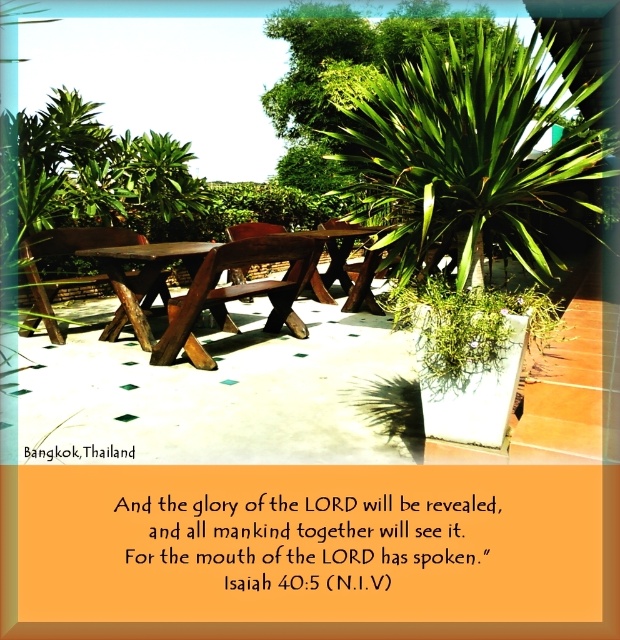
You are planning to host a small gathering in the outdoor seating area in Bangkok. You need to seat 8 people. Which table between the dark brown wood picnic table at center and the brown wooden table at center can accommodate more guests?

The dark brown wood picnic table at center can accommodate more guests because its width is larger than the brown wooden table at center.

You are planning to host a small gathering for 10 people in the outdoor seating area. Which table between the dark brown wood picnic table at center and the natural wood table at center would accommodate more guests comfortably?

The dark brown wood picnic table at center is larger in size than the natural wood table at center, so it can accommodate more guests comfortably.